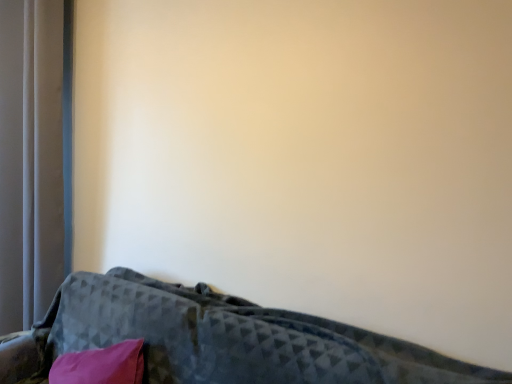
Where is `velvet dark gray couch at lower left`? velvet dark gray couch at lower left is located at coordinates (219, 339).

What do you see at coordinates (219, 339) in the screenshot?
I see `velvet dark gray couch at lower left` at bounding box center [219, 339].

The height and width of the screenshot is (384, 512). What do you see at coordinates (34, 157) in the screenshot? I see `silky gray curtain at left` at bounding box center [34, 157].

At what (x,y) coordinates should I click in order to perform the action: click on silky gray curtain at left. Please return your answer as a coordinate pair (x, y). This screenshot has height=384, width=512. Looking at the image, I should click on (34, 157).

What is the approximate width of silky gray curtain at left?

silky gray curtain at left is 11.98 inches wide.

Where is `velvet dark gray couch at lower left`? This screenshot has width=512, height=384. velvet dark gray couch at lower left is located at coordinates (219, 339).

In the image, is velvet dark gray couch at lower left on the left side or the right side of silky gray curtain at left?

velvet dark gray couch at lower left is positioned on silky gray curtain at left's right side.

Is velvet dark gray couch at lower left positioned behind silky gray curtain at left?

No, velvet dark gray couch at lower left is closer to the viewer.

Which is nearer, (263, 329) or (2, 77)?

Point (263, 329) is closer to the camera than point (2, 77).

From the image's perspective, is velvet dark gray couch at lower left positioned above or below silky gray curtain at left?

velvet dark gray couch at lower left is below silky gray curtain at left.

From a real-world perspective, which object rests below the other?

In real-world perspective, velvet dark gray couch at lower left is lower.

In terms of width, does velvet dark gray couch at lower left look wider or thinner when compared to silky gray curtain at left?

In the image, velvet dark gray couch at lower left appears to be wider than silky gray curtain at left.

Considering the sizes of velvet dark gray couch at lower left and silky gray curtain at left in the image, is velvet dark gray couch at lower left taller or shorter than silky gray curtain at left?

Considering their sizes, velvet dark gray couch at lower left has less height than silky gray curtain at left.

Does velvet dark gray couch at lower left have a larger size compared to silky gray curtain at left?

Correct, velvet dark gray couch at lower left is larger in size than silky gray curtain at left.

Would you say silky gray curtain at left is part of velvet dark gray couch at lower left's contents?

No, silky gray curtain at left is not inside velvet dark gray couch at lower left.

Is velvet dark gray couch at lower left touching silky gray curtain at left?

velvet dark gray couch at lower left and silky gray curtain at left are clearly separated.

Could you tell me if velvet dark gray couch at lower left is facing silky gray curtain at left?

No, velvet dark gray couch at lower left is not oriented towards silky gray curtain at left.

Image resolution: width=512 pixels, height=384 pixels. In order to click on curtain located on the left of velvet dark gray couch at lower left in this screenshot , I will do `click(34, 157)`.

Considering the relative positions of silky gray curtain at left and velvet dark gray couch at lower left in the image provided, is silky gray curtain at left to the left of velvet dark gray couch at lower left from the viewer's perspective?

Correct, you'll find silky gray curtain at left to the left of velvet dark gray couch at lower left.

Is the position of silky gray curtain at left more distant than that of velvet dark gray couch at lower left?

Yes, silky gray curtain at left is further from the viewer.

Is point (28, 2) farther from camera compared to point (68, 321)?

Yes, point (28, 2) is behind point (68, 321).

From the image's perspective, which object appears higher, silky gray curtain at left or velvet dark gray couch at lower left?

silky gray curtain at left appears higher in the image.

From a real-world perspective, is silky gray curtain at left above or below velvet dark gray couch at lower left?

silky gray curtain at left is situated higher than velvet dark gray couch at lower left in the real world.

Which of these two, silky gray curtain at left or velvet dark gray couch at lower left, is wider?

With larger width is velvet dark gray couch at lower left.

Can you confirm if silky gray curtain at left is shorter than velvet dark gray couch at lower left?

Incorrect, the height of silky gray curtain at left does not fall short of that of velvet dark gray couch at lower left.

Considering the relative sizes of silky gray curtain at left and velvet dark gray couch at lower left in the image provided, is silky gray curtain at left bigger than velvet dark gray couch at lower left?

No.

Is silky gray curtain at left outside of velvet dark gray couch at lower left?

silky gray curtain at left lies outside velvet dark gray couch at lower left's area.

Would you consider silky gray curtain at left to be distant from velvet dark gray couch at lower left?

No, silky gray curtain at left is not far from velvet dark gray couch at lower left.

Is silky gray curtain at left oriented away from velvet dark gray couch at lower left?

No, silky gray curtain at left is not facing the opposite direction of velvet dark gray couch at lower left.

The width and height of the screenshot is (512, 384). There is a velvet dark gray couch at lower left. What are the coordinates of `curtain above it (from a real-world perspective)` in the screenshot? It's located at (34, 157).

Locate an element on the screen. curtain above the velvet dark gray couch at lower left (from the image's perspective) is located at coordinates (34, 157).

This screenshot has width=512, height=384. In order to click on curtain on the left of velvet dark gray couch at lower left in this screenshot , I will do `click(34, 157)`.